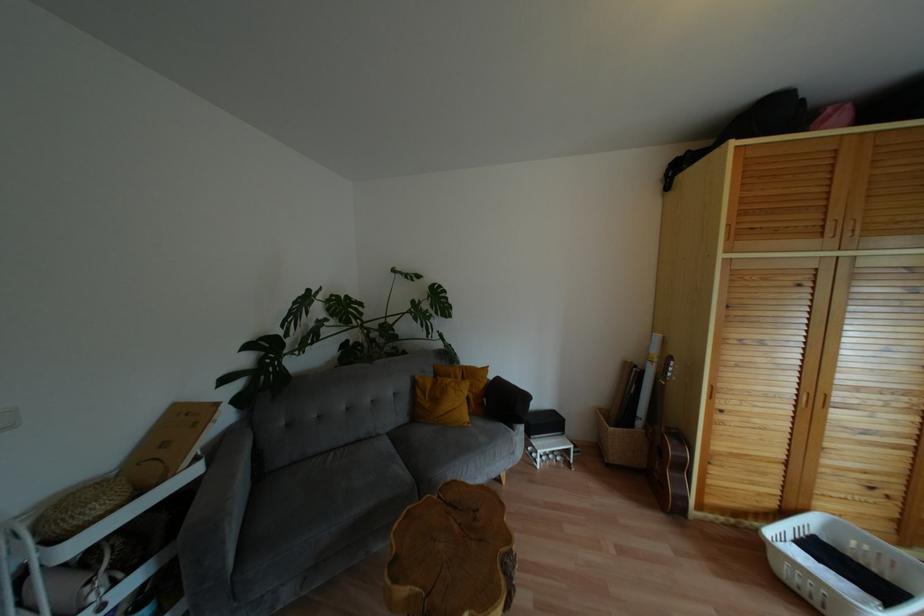
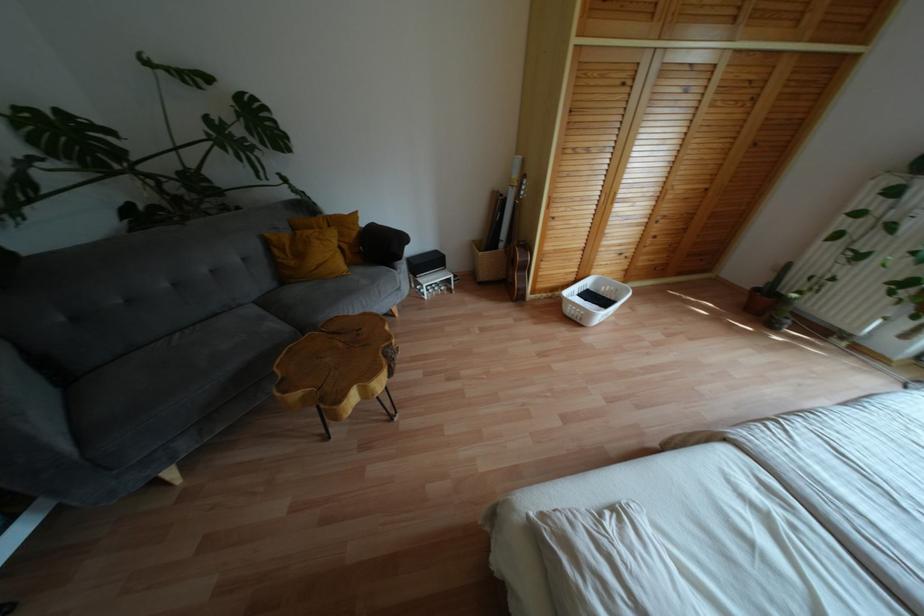
In the second image, find the point that corresponds to point (682, 467) in the first image.

(525, 267)